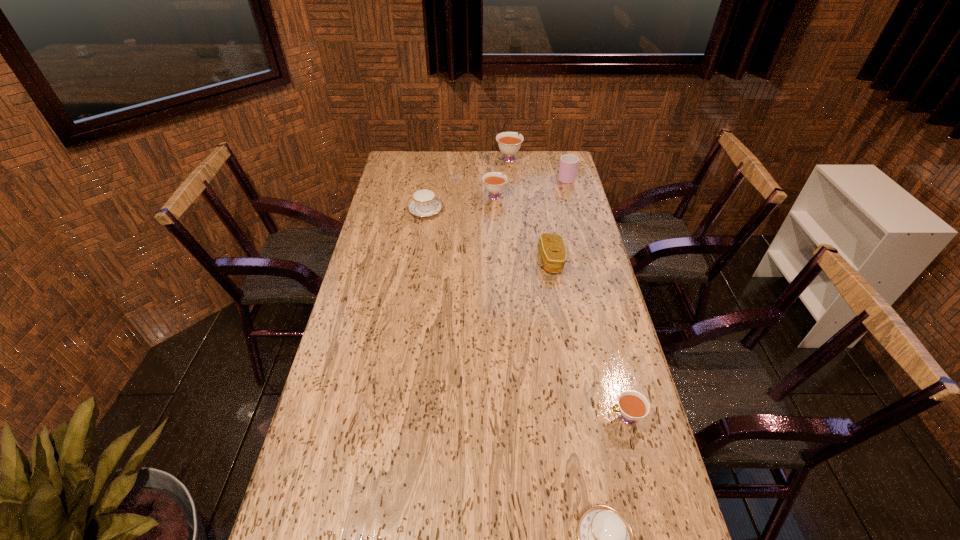
The height and width of the screenshot is (540, 960). What are the coordinates of `vacant region located 0.060m with the handle on the side of the cup` in the screenshot? It's located at (563, 164).

Locate an element on the screen. This screenshot has width=960, height=540. vacant space located 0.060m with the handle on the side of the cup is located at coordinates (563, 164).

At what (x,y) coordinates should I click in order to perform the action: click on vacant space located 0.110m with the handle on the side of the cup. Please return your answer as a coordinate pair (x, y). Looking at the image, I should click on (562, 158).

The width and height of the screenshot is (960, 540). In order to click on blank space located 0.270m on the side of the second farthest white teacup with the handle in this screenshot , I will do `click(492, 158)`.

Locate an element on the screen. The width and height of the screenshot is (960, 540). vacant region located on the side of the second farthest white teacup with the handle is located at coordinates (492, 154).

The height and width of the screenshot is (540, 960). In order to click on vacant space located on the side of the second farthest white teacup with the handle in this screenshot , I will do `click(493, 168)`.

Locate an element on the screen. This screenshot has height=540, width=960. vacant space situated 0.100m on the zipper side of the brown clutch bag is located at coordinates (512, 261).

What are the coordinates of `vacant space located on the zipper side of the brown clutch bag` in the screenshot? It's located at (438, 261).

The height and width of the screenshot is (540, 960). Find the location of `free location located on the zipper side of the brown clutch bag`. free location located on the zipper side of the brown clutch bag is located at coordinates point(494,261).

Locate an element on the screen. The width and height of the screenshot is (960, 540). free space located 0.290m on the side with the handle of the left blue teacup is located at coordinates (432, 166).